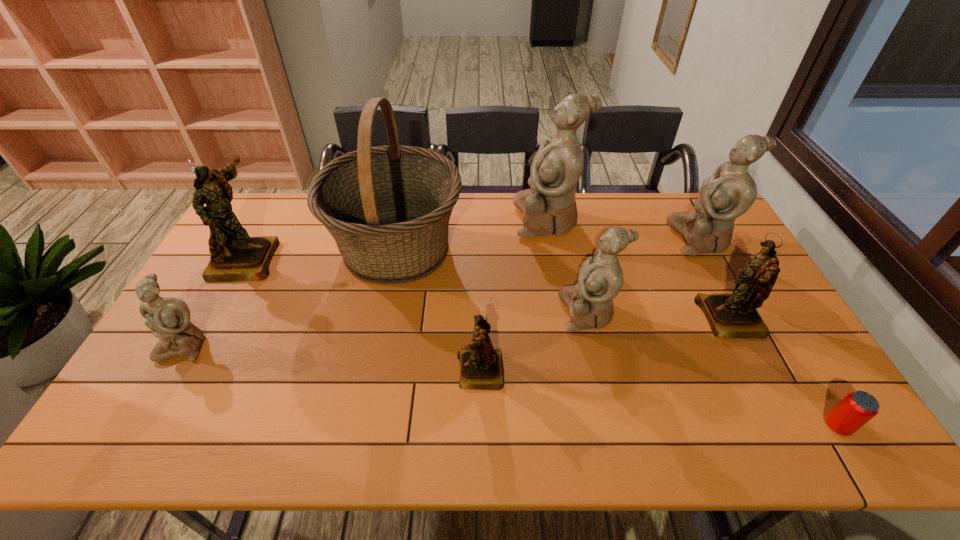
Where is `empty space that is in between the third smallest white figurine and the basket`? empty space that is in between the third smallest white figurine and the basket is located at coordinates (549, 244).

At what (x,y) coordinates should I click in order to perform the action: click on free spot between the rightmost white figurine and the second biggest gold figurine. Please return your answer as a coordinate pair (x, y). The width and height of the screenshot is (960, 540). Looking at the image, I should click on click(x=715, y=279).

In order to click on unoccupied area between the basket and the biggest white figurine in this screenshot , I will do `click(472, 234)`.

The height and width of the screenshot is (540, 960). Find the location of `vacant area that lies between the smallest white figurine and the shortest object`. vacant area that lies between the smallest white figurine and the shortest object is located at coordinates (510, 386).

This screenshot has width=960, height=540. I want to click on empty space that is in between the second smallest white figurine and the biggest white figurine, so click(567, 266).

Find the location of a particular element. This screenshot has width=960, height=540. vacant space that's between the rightmost white figurine and the leftmost white figurine is located at coordinates (442, 292).

Where is `empty location between the biggest gold figurine and the shortest object`? This screenshot has height=540, width=960. empty location between the biggest gold figurine and the shortest object is located at coordinates (541, 342).

Identify the location of free space between the smallest white figurine and the second smallest white figurine. (386, 329).

Identify the location of vacant space that is in between the can and the leftmost gold figurine. The height and width of the screenshot is (540, 960). (541, 342).

Where is `object that is the nearest to the smallest gold figurine`? The width and height of the screenshot is (960, 540). object that is the nearest to the smallest gold figurine is located at coordinates (590, 302).